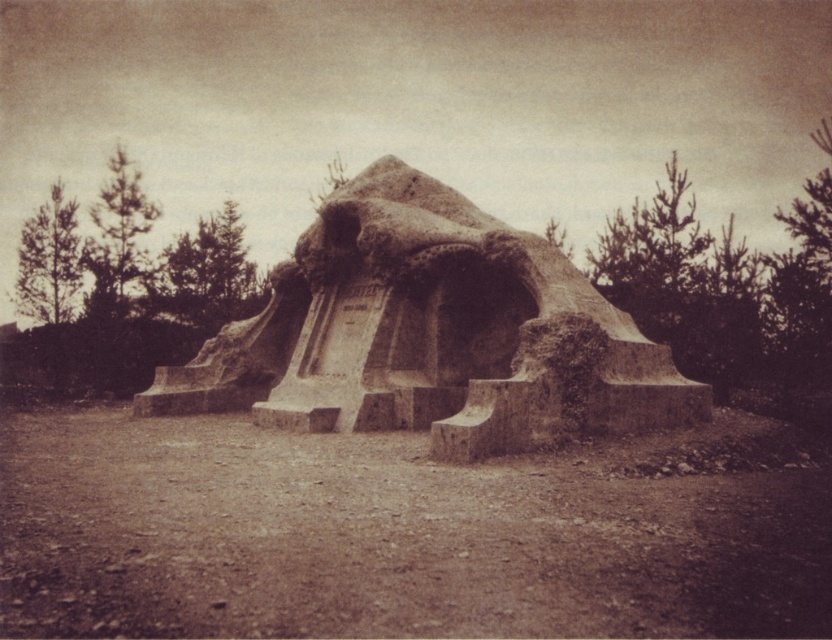
Question: Is brown dirt field at center to the left of rustic stone sculpture at center from the viewer's perspective?

Choices:
 (A) no
 (B) yes

Answer: (B)

Question: Can you confirm if brown dirt field at center is smaller than rustic stone sculpture at center?

Choices:
 (A) no
 (B) yes

Answer: (B)

Question: From the image, what is the correct spatial relationship of brown dirt field at center in relation to rustic stone sculpture at center?

Choices:
 (A) above
 (B) below

Answer: (B)

Question: Which of the following is the closest to the observer?

Choices:
 (A) brown dirt field at center
 (B) rustic stone sculpture at center

Answer: (A)